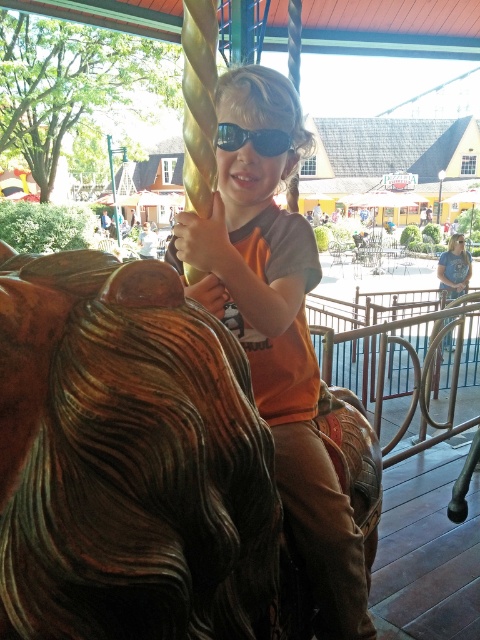
You are a photographer taking a picture of the child on the carousel. You notice the orange matte shirt at center and the black reflective sunglasses at center. Which object should you adjust to ensure the sunglasses don not reflect glare from the sunlight?

The orange matte shirt at center is below black reflective sunglasses at center. To prevent glare, adjust the position of the black reflective sunglasses at center so it is not facing the sunlight directly.